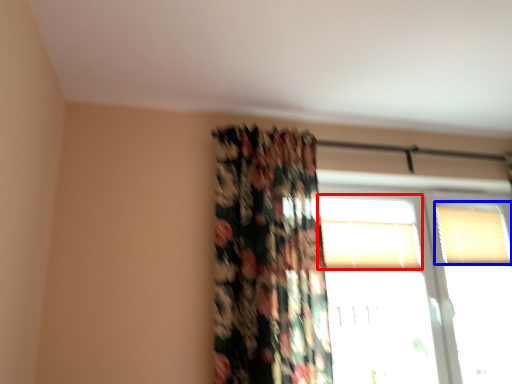
Question: Which object appears closest to the camera in this image, window (highlighted by a red box) or window (highlighted by a blue box)?

Choices:
 (A) window
 (B) window

Answer: (A)